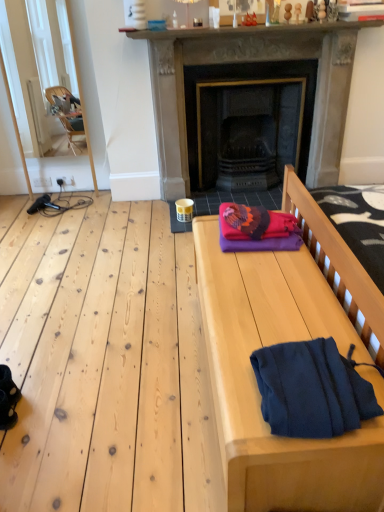
Question: Based on their sizes in the image, would you say dark gray stone fireplace at center is bigger or smaller than smooth wooden bench at right?

Choices:
 (A) big
 (B) small

Answer: (A)

Question: Relative to smooth wooden bench at right, is dark gray stone fireplace at center in front or behind?

Choices:
 (A) front
 (B) behind

Answer: (B)

Question: Which is nearer to the dark blue fleece at lower right?

Choices:
 (A) smooth stone mantle at upper center
 (B) knitted woolen blanket at center
 (C) dark gray stone fireplace at center
 (D) smooth wooden bench at right

Answer: (D)

Question: Estimate the real-world distances between objects in this image. Which object is closer to the smooth stone mantle at upper center?

Choices:
 (A) dark gray stone fireplace at center
 (B) smooth wooden bench at right
 (C) knitted woolen blanket at center
 (D) dark blue fleece at lower right

Answer: (A)